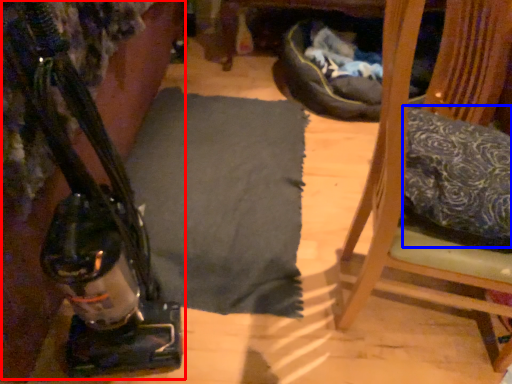
Question: Which object is closer to the camera taking this photo, job (highlighted by a red box) or pillow (highlighted by a blue box)?

Choices:
 (A) job
 (B) pillow

Answer: (A)